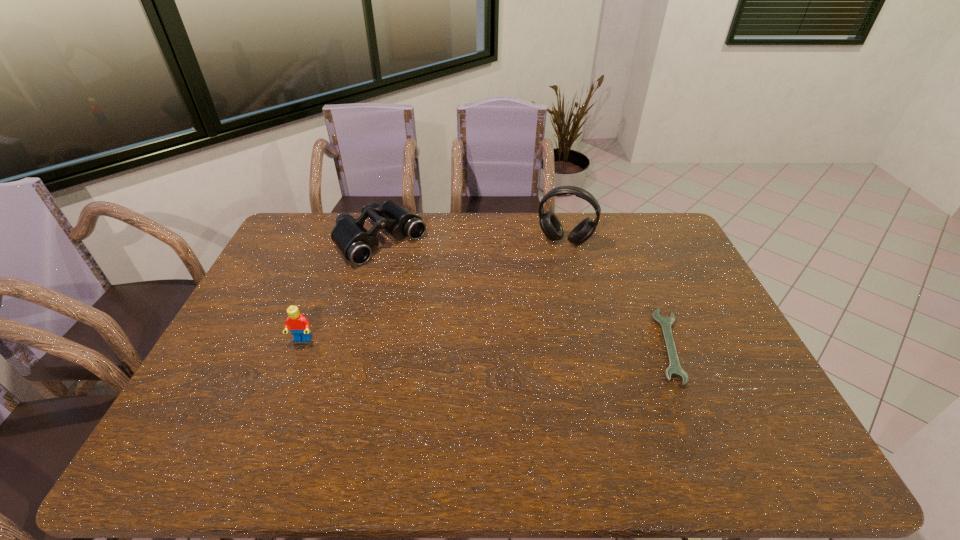
In the image, there is a desktop. Where is `free region at the right edge`? The width and height of the screenshot is (960, 540). free region at the right edge is located at coordinates (663, 264).

The height and width of the screenshot is (540, 960). Identify the location of free space at the far left corner of the desktop. (300, 245).

Locate an element on the screen. The image size is (960, 540). free space that is in between the Lego and the binoculars is located at coordinates (342, 291).

Where is `free point between the binoculars and the Lego`? The width and height of the screenshot is (960, 540). free point between the binoculars and the Lego is located at coordinates (342, 291).

Locate an element on the screen. free spot between the binoculars and the Lego is located at coordinates (342, 291).

Find the location of a particular element. The height and width of the screenshot is (540, 960). unoccupied position between the headset and the Lego is located at coordinates (434, 291).

The image size is (960, 540). In order to click on vacant space that's between the rightmost object and the headset in this screenshot , I will do `click(617, 293)`.

Identify the location of free space between the binoculars and the rightmost object. The height and width of the screenshot is (540, 960). (525, 293).

The height and width of the screenshot is (540, 960). Find the location of `empty space between the Lego and the wrench`. empty space between the Lego and the wrench is located at coordinates (486, 343).

The width and height of the screenshot is (960, 540). Find the location of `vacant area that lies between the binoculars and the rightmost object`. vacant area that lies between the binoculars and the rightmost object is located at coordinates [x=525, y=293].